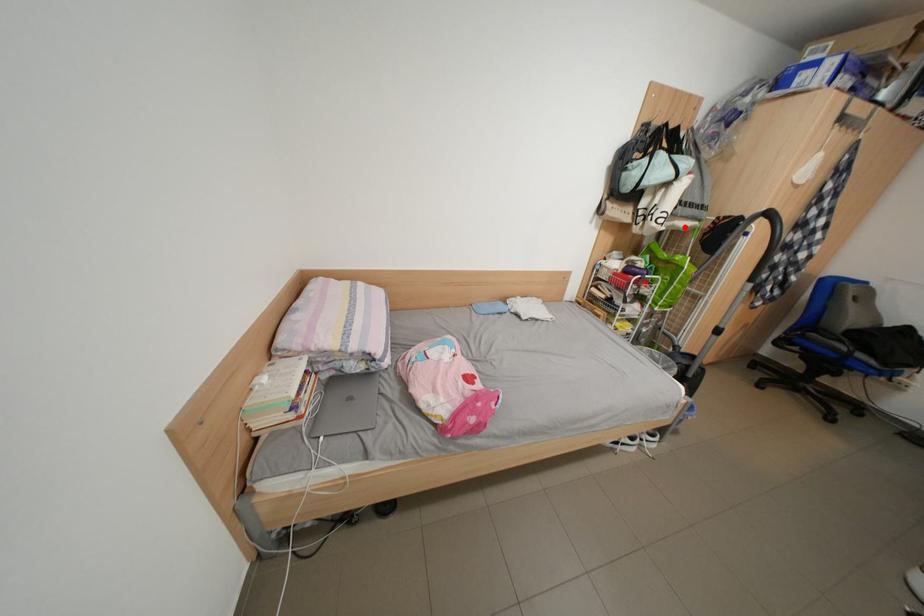
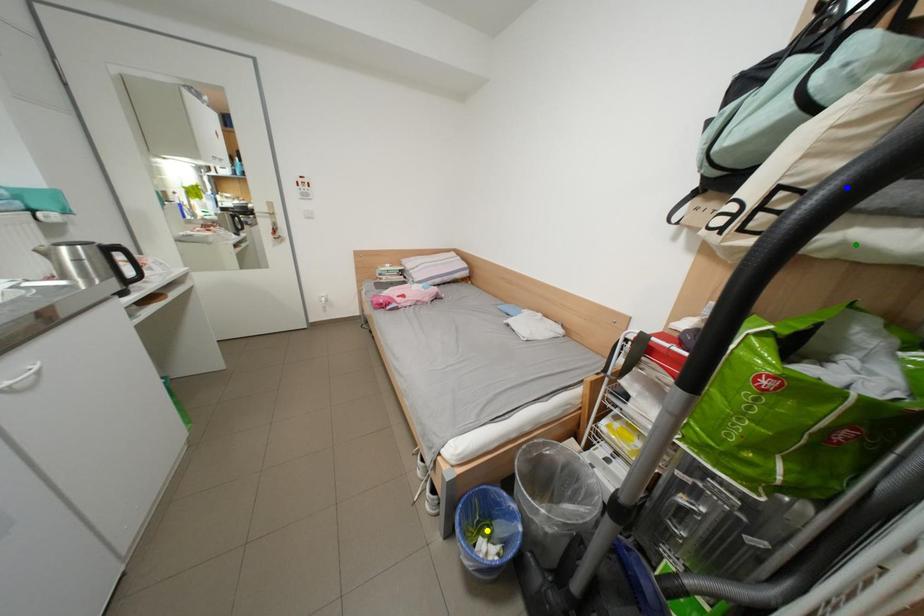
Question: I am providing you with two images of the same scene from different viewpoints. A red point is marked on the first image. You are given multiple points on the second image. Can you choose the point in image 2 that corresponds to the point in image 1?

Choices:
 (A) yellow point
 (B) green point
 (C) blue point

Answer: (B)